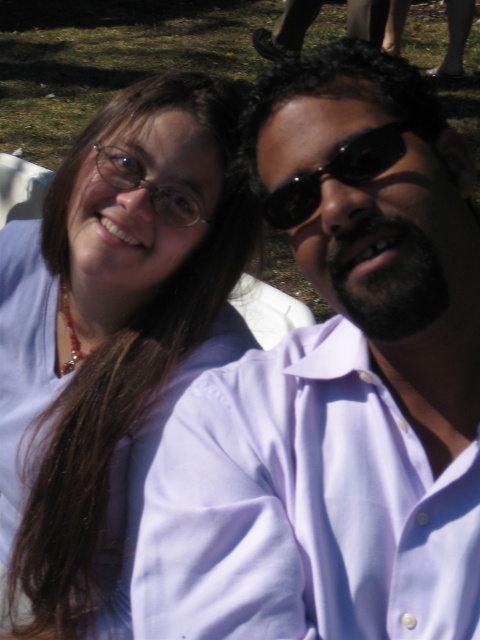
Question: Among these objects, which one is farthest from the camera?

Choices:
 (A) matte white shirt at upper right
 (B) matte white shirt at left
 (C) black matte sunglasses at upper right

Answer: (B)

Question: Observing the image, what is the correct spatial positioning of matte white shirt at left in reference to black matte sunglasses at upper right?

Choices:
 (A) right
 (B) left

Answer: (B)

Question: Estimate the real-world distances between objects in this image. Which object is farther from the matte white shirt at left?

Choices:
 (A) black matte sunglasses at upper right
 (B) matte white shirt at upper right

Answer: (A)

Question: Which of the following is the farthest from the observer?

Choices:
 (A) black matte sunglasses at upper right
 (B) matte white shirt at left
 (C) matte white shirt at upper right

Answer: (B)

Question: Does matte white shirt at upper right lie in front of matte white shirt at left?

Choices:
 (A) no
 (B) yes

Answer: (B)

Question: Can you confirm if matte white shirt at upper right is positioned to the right of matte white shirt at left?

Choices:
 (A) yes
 (B) no

Answer: (A)